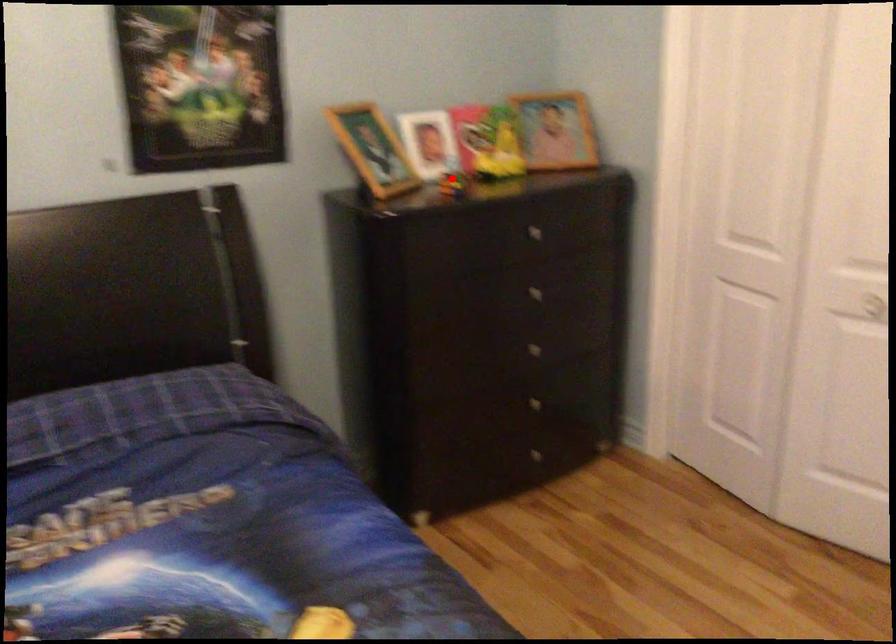
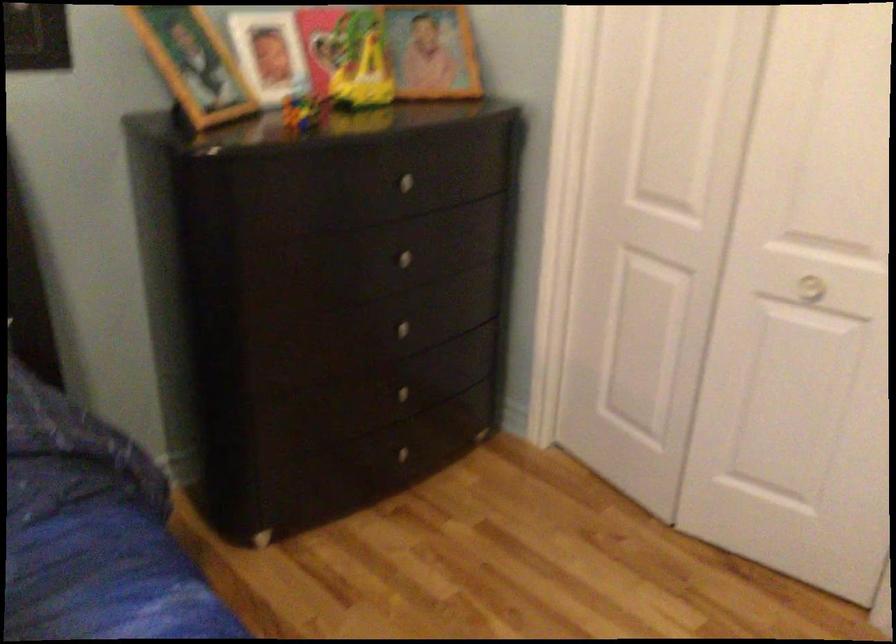
Question: A red point is marked in image1. In image2, is the corresponding 3D point closer to the camera or farther? Reply with the corresponding letter.

Choices:
 (A) The corresponding 3D point is closer.
 (B) The corresponding 3D point is farther.

Answer: (A)